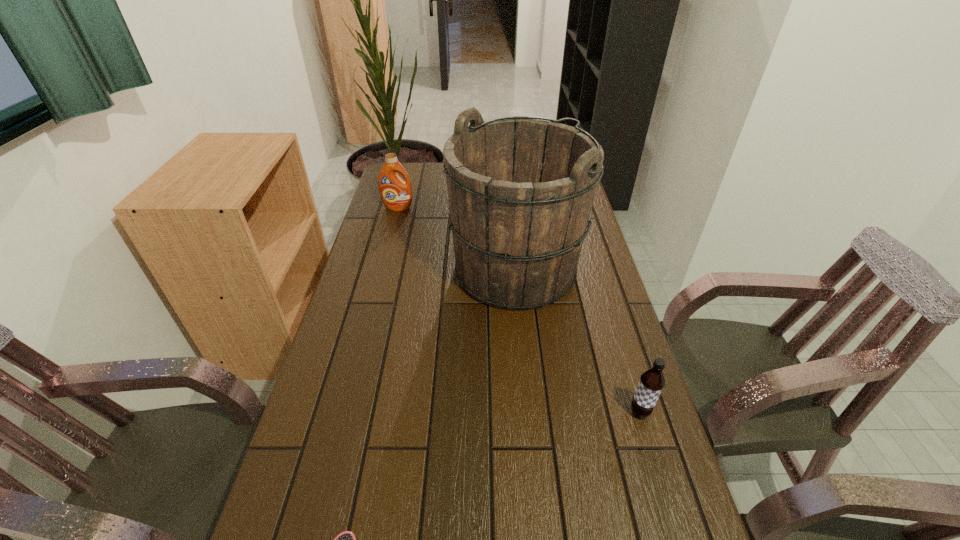
Image resolution: width=960 pixels, height=540 pixels. I want to click on the third nearest object, so [x=520, y=190].

At what (x,y) coordinates should I click in order to perform the action: click on the second object from right to left. Please return your answer as a coordinate pair (x, y). Looking at the image, I should click on (520, 190).

The width and height of the screenshot is (960, 540). I want to click on the farthest object, so click(x=396, y=194).

This screenshot has height=540, width=960. Find the location of `the second tallest object`. the second tallest object is located at coordinates (396, 194).

At what (x,y) coordinates should I click in order to perform the action: click on root beer. Please return your answer as a coordinate pair (x, y). Image resolution: width=960 pixels, height=540 pixels. Looking at the image, I should click on (651, 383).

Identify the location of the second shortest object. Image resolution: width=960 pixels, height=540 pixels. (651, 383).

You are a GUI agent. You are given a task and a screenshot of the screen. Output one action in this format:
    pyautogui.click(x=<x>, y=<y>)
    Task: Click on the blank area located 0.360m on the back of the second object from right to left
    
    Given the screenshot: What is the action you would take?
    507,181

Where is `vacant area situated 0.190m on the front-facing side of the farthest object`? The height and width of the screenshot is (540, 960). vacant area situated 0.190m on the front-facing side of the farthest object is located at coordinates (389, 241).

In order to click on free location located 0.050m on the front of the third tallest object in this screenshot , I will do `click(649, 443)`.

The width and height of the screenshot is (960, 540). I want to click on object at the left edge, so click(396, 194).